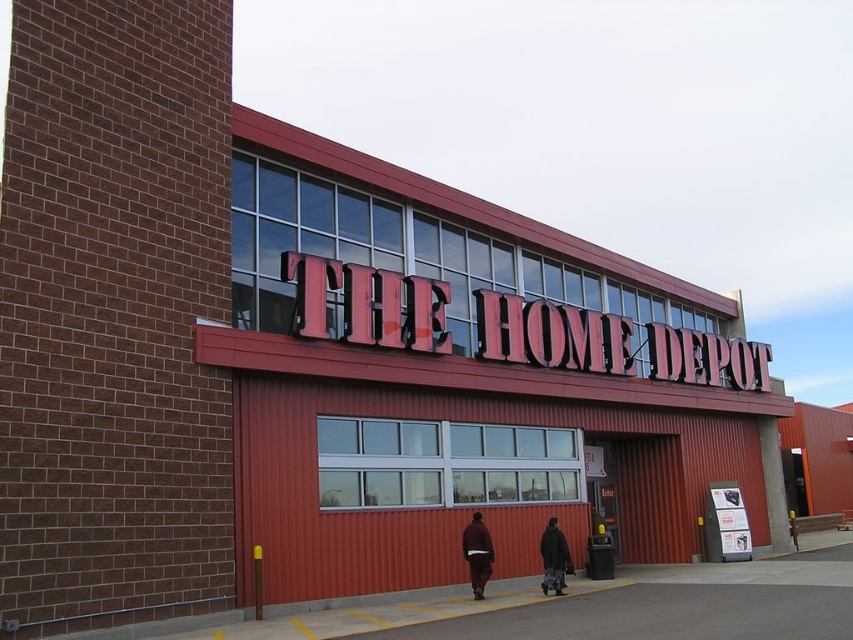
You are trying to decide which item to take for a casual day out. Both the brown wool sweater at center and the dark brown textured coat at center are available. Which one is more suitable if you prefer something lighter and easier to carry?

The brown wool sweater at center has a smaller size compared to the dark brown textured coat at center, making it lighter and easier to carry for a casual day out.

You are a customer entering the Home Depot store and notice two items hanging on a rack at the center of the entrance. The items are a brown wool sweater at center and a dark brown textured coat at center. Which item is taller when hanging?

The brown wool sweater at center is taller than the dark brown textured coat at center.

You are standing in front of the Home Depot store. Where is the brown wool sweater at center located in relation to the building?

The brown wool sweater at center is located at point 0.866 on the x axis and 0.560 on the y axis relative to the building.